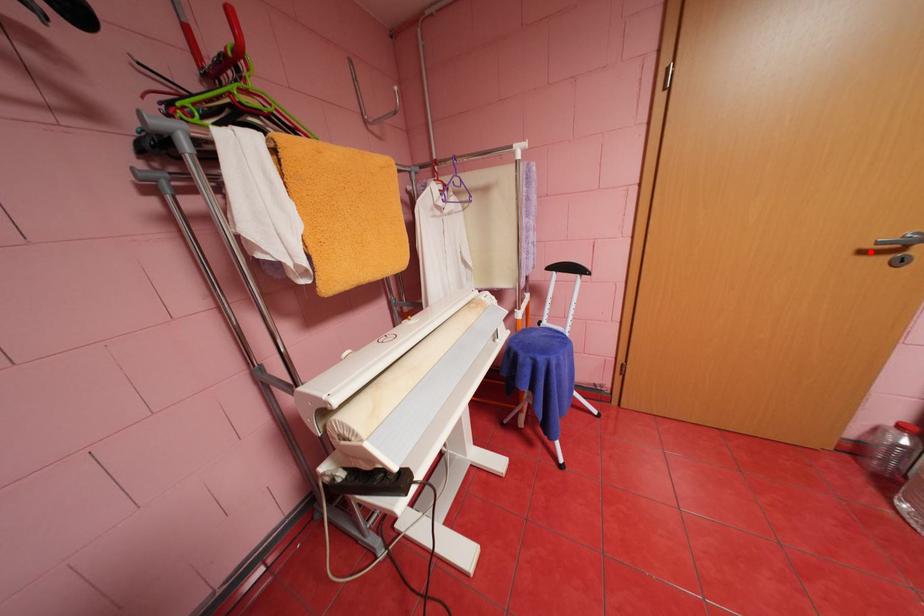
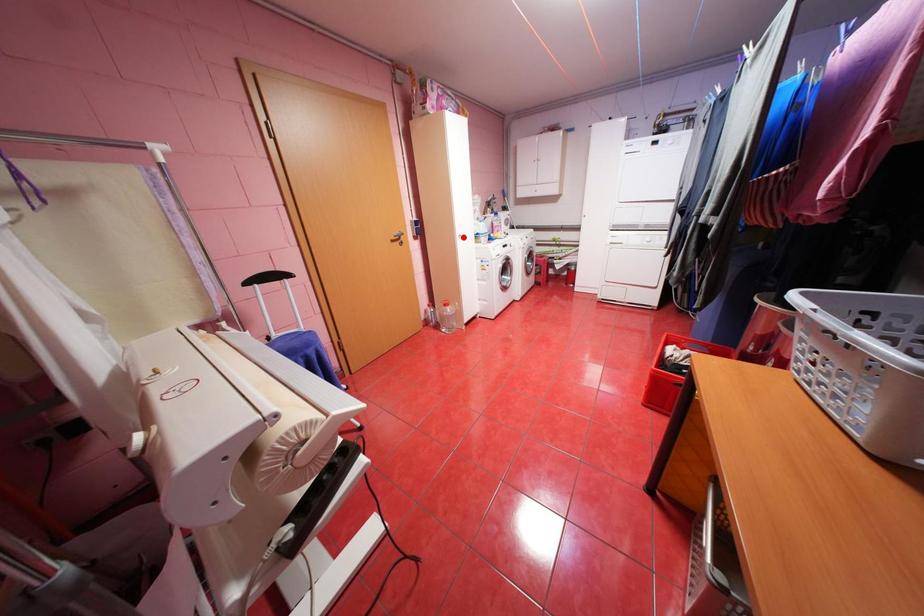
Looking at this image, I am providing you with two images of the same scene from different viewpoints. A red point is marked on the first image and another point is marked on the second image. Is the marked point in image1 the same physical position as the marked point in image2?

No